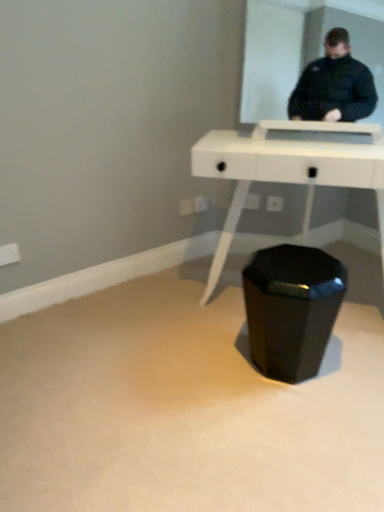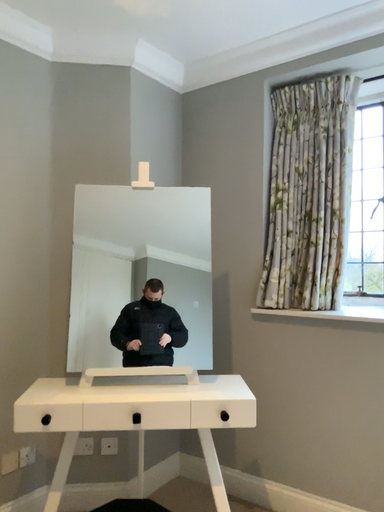
Question: Which way did the camera rotate in the video?

Choices:
 (A) rotated upward
 (B) rotated downward

Answer: (A)